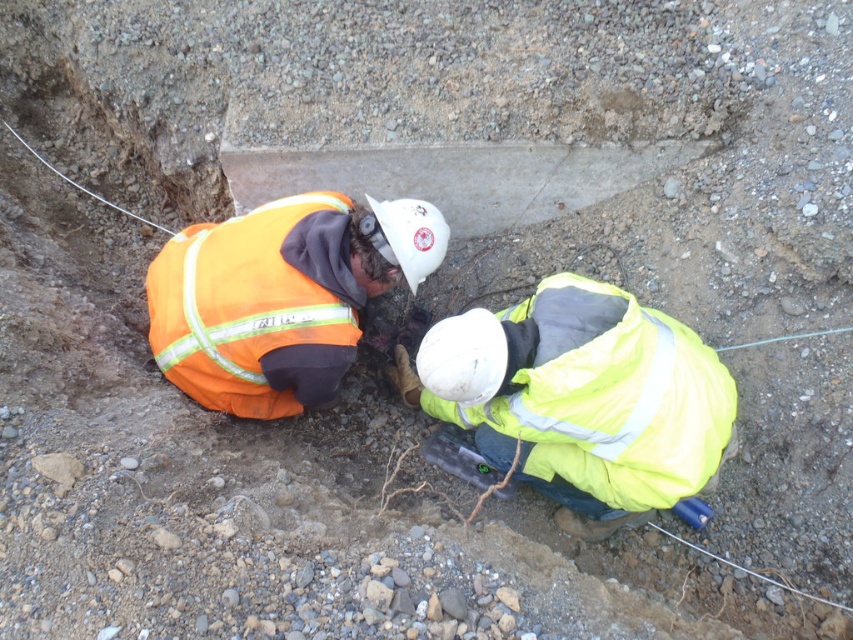
Question: Is yellow reflective jacket at center thinner than orange reflective safety vest at lower left?

Choices:
 (A) yes
 (B) no

Answer: (B)

Question: Is yellow reflective jacket at center above orange reflective safety vest at lower left?

Choices:
 (A) no
 (B) yes

Answer: (A)

Question: Can you confirm if yellow reflective jacket at center is smaller than orange reflective safety vest at lower left?

Choices:
 (A) no
 (B) yes

Answer: (A)

Question: Which of the following is the closest to the observer?

Choices:
 (A) (579, 358)
 (B) (300, 237)

Answer: (A)